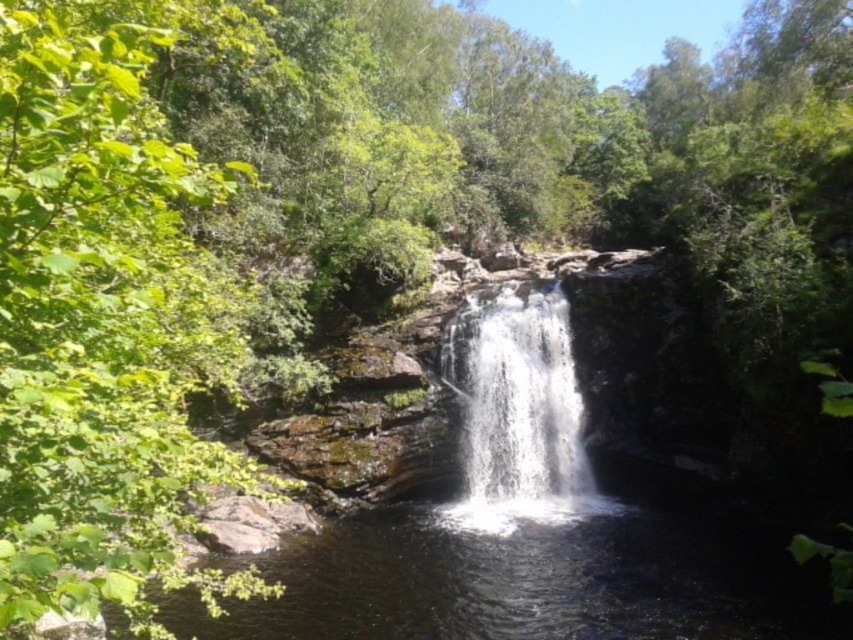
Question: Is green leafy tree at left positioned before white frothy water at center?

Choices:
 (A) yes
 (B) no

Answer: (A)

Question: Can you confirm if green leafy tree at left is positioned below white frothy water at center?

Choices:
 (A) no
 (B) yes

Answer: (A)

Question: Among these points, which one is farthest from the camera?

Choices:
 (A) (506, 285)
 (B) (26, 358)

Answer: (A)

Question: Observing the image, what is the correct spatial positioning of green leafy tree at left in reference to white frothy water at center?

Choices:
 (A) left
 (B) right

Answer: (A)